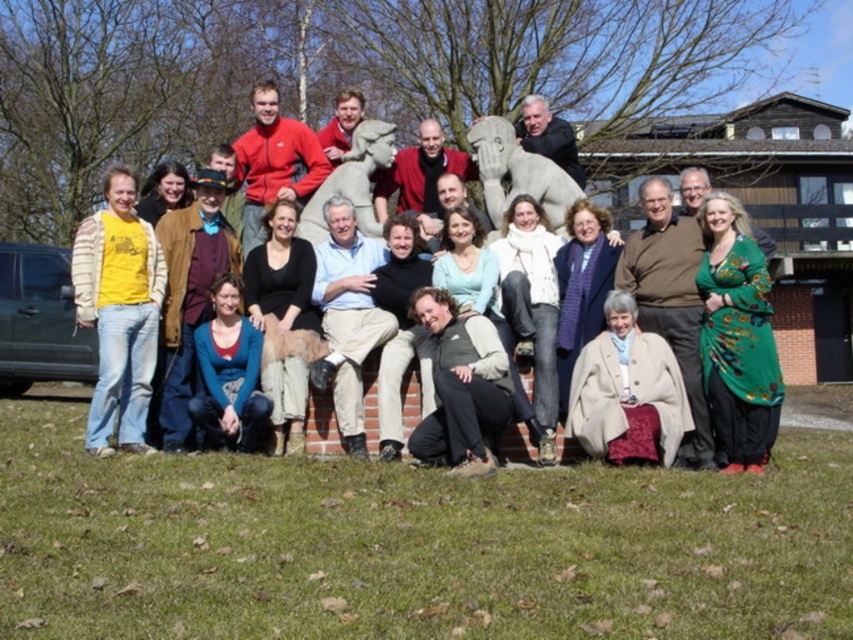
You are a photographer adjusting the camera to capture the entire group in the photo. The camera has a maximum focus range of 5 meters. Can you include both the green silk dress at lower right and the green fuzzy vest at center in the same shot without moving the camera?

The distance between the green silk dress at lower right and the green fuzzy vest at center is 5.40 meters, which exceeds the camera maximum focus range of 5 meters. Therefore, you cannot include both in the same shot without moving the camera.